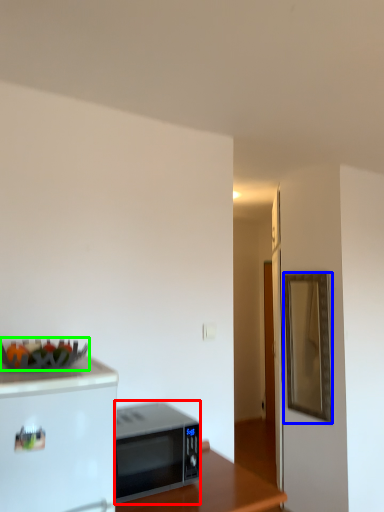
Question: Estimate the real-world distances between objects in this image. Which object is farther from microwave oven (highlighted by a red box), mirror (highlighted by a blue box) or food (highlighted by a green box)?

Choices:
 (A) mirror
 (B) food

Answer: (A)